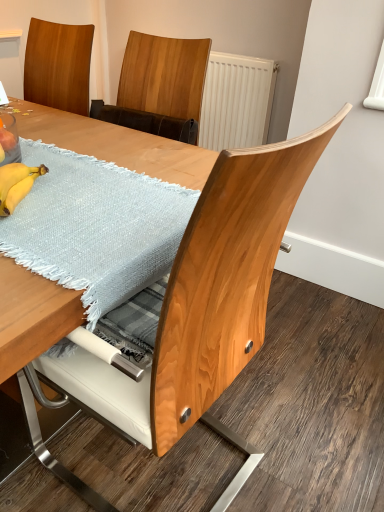
In the scene shown: In order to face light blue woven placemat at upper left, acting as the 1th table starting from the top, should I rotate leftwards or rightwards?

Rotate your view left by about 21.076°.

What do you see at coordinates (118, 144) in the screenshot? I see `wooden table at center, the 1th table in the bottom-to-top sequence` at bounding box center [118, 144].

This screenshot has height=512, width=384. Find the location of `light blue woven placemat at upper left, acting as the 1th table starting from the top`. light blue woven placemat at upper left, acting as the 1th table starting from the top is located at coordinates (115, 144).

At what (x,y) coordinates should I click in order to perform the action: click on table that is the 2nd one when counting rightward from the yellow matte bananas at lower left. Please return your answer as a coordinate pair (x, y). Image resolution: width=384 pixels, height=512 pixels. Looking at the image, I should click on (118, 144).

Is wooden table at center, the 1th table in the bottom-to-top sequence, inside or outside of yellow matte bananas at lower left?

The correct answer is: outside.

From a real-world perspective, relative to yellow matte bananas at lower left, is wooden table at center, the 1th table in the bottom-to-top sequence, vertically above or below?

wooden table at center, the 1th table in the bottom-to-top sequence, is situated lower than yellow matte bananas at lower left in the real world.

Between yellow matte bananas at lower left and wooden table at center, the second table when ordered from top to bottom, which one has smaller width?

yellow matte bananas at lower left.

From the image's perspective, between yellow matte bananas at lower left and wooden table at center, the 1th table in the bottom-to-top sequence, who is located below?

wooden table at center, the 1th table in the bottom-to-top sequence, is shown below in the image.

Is yellow matte bananas at lower left outside of wooden table at center, the second table when ordered from top to bottom?

No, yellow matte bananas at lower left is inside wooden table at center, the second table when ordered from top to bottom,'s boundary.

In the scene shown: How many degrees apart are the facing directions of yellow matte bananas at lower left and wooden table at center, the 1th table in the bottom-to-top sequence?

149 degrees.

Could you tell me if wooden table at center, the second table when ordered from top to bottom, is facing light blue woven placemat at upper left, positioned as the 2th table in bottom-to-top order?

Yes, wooden table at center, the second table when ordered from top to bottom, is aimed at light blue woven placemat at upper left, positioned as the 2th table in bottom-to-top order.

Between wooden table at center, the 1th table in the bottom-to-top sequence, and light blue woven placemat at upper left, positioned as the 2th table in bottom-to-top order, which one has larger width?

light blue woven placemat at upper left, positioned as the 2th table in bottom-to-top order.

Can you confirm if wooden table at center, the second table when ordered from top to bottom, is taller than light blue woven placemat at upper left, acting as the 1th table starting from the top?

Yes.

Which object is thinner, light blue woven placemat at upper left, positioned as the 2th table in bottom-to-top order, or yellow matte bananas at lower left?

With smaller width is yellow matte bananas at lower left.

Considering the positions of objects light blue woven placemat at upper left, positioned as the 2th table in bottom-to-top order, and yellow matte bananas at lower left in the image provided, who is in front, light blue woven placemat at upper left, positioned as the 2th table in bottom-to-top order, or yellow matte bananas at lower left?

light blue woven placemat at upper left, positioned as the 2th table in bottom-to-top order.

Which is in front, point (11, 362) or point (21, 194)?

The point (11, 362) is closer.

Is light blue woven placemat at upper left, acting as the 1th table starting from the top, looking in the opposite direction of yellow matte bananas at lower left?

Yes.

Based on the photo, is yellow matte bananas at lower left shorter than light blue woven placemat at upper left, acting as the 1th table starting from the top?

No.

In the scene shown: Is yellow matte bananas at lower left outside of light blue woven placemat at upper left, positioned as the 2th table in bottom-to-top order?

Yes, yellow matte bananas at lower left is outside of light blue woven placemat at upper left, positioned as the 2th table in bottom-to-top order.

The image size is (384, 512). Find the location of `table that is the 1st object directly below the yellow matte bananas at lower left (from a real-world perspective)`. table that is the 1st object directly below the yellow matte bananas at lower left (from a real-world perspective) is located at coordinates (115, 144).

Is point (11, 198) positioned in front of point (47, 125)?

Yes, point (11, 198) is in front of point (47, 125).

Where is `table below the light blue woven placemat at upper left, positioned as the 2th table in bottom-to-top order (from the image's perspective)`? The height and width of the screenshot is (512, 384). table below the light blue woven placemat at upper left, positioned as the 2th table in bottom-to-top order (from the image's perspective) is located at coordinates (118, 144).

From a real-world perspective, is light blue woven placemat at upper left, positioned as the 2th table in bottom-to-top order, physically above wooden table at center, the second table when ordered from top to bottom?

Yes, from a real-world perspective, light blue woven placemat at upper left, positioned as the 2th table in bottom-to-top order, is on top of wooden table at center, the second table when ordered from top to bottom.

Are light blue woven placemat at upper left, acting as the 1th table starting from the top, and wooden table at center, the 1th table in the bottom-to-top sequence, located far from each other?

No, there isn't a large distance between light blue woven placemat at upper left, acting as the 1th table starting from the top, and wooden table at center, the 1th table in the bottom-to-top sequence.

Considering the sizes of objects light blue woven placemat at upper left, positioned as the 2th table in bottom-to-top order, and wooden table at center, the second table when ordered from top to bottom, in the image provided, who is taller, light blue woven placemat at upper left, positioned as the 2th table in bottom-to-top order, or wooden table at center, the second table when ordered from top to bottom,?

With more height is wooden table at center, the second table when ordered from top to bottom.

Where is `table below the yellow matte bananas at lower left (from the image's perspective)`? The image size is (384, 512). table below the yellow matte bananas at lower left (from the image's perspective) is located at coordinates point(118,144).

The width and height of the screenshot is (384, 512). Find the location of `banana that is on the left side of wooden table at center, the 1th table in the bottom-to-top sequence`. banana that is on the left side of wooden table at center, the 1th table in the bottom-to-top sequence is located at coordinates (16, 184).

Which object lies further to the anchor point light blue woven placemat at upper left, positioned as the 2th table in bottom-to-top order, wooden table at center, the second table when ordered from top to bottom, or yellow matte bananas at lower left?

Based on the image, wooden table at center, the second table when ordered from top to bottom, appears to be further to light blue woven placemat at upper left, positioned as the 2th table in bottom-to-top order.

Considering their positions, is yellow matte bananas at lower left positioned closer to light blue woven placemat at upper left, positioned as the 2th table in bottom-to-top order, than wooden table at center, the 1th table in the bottom-to-top sequence?

The object closer to light blue woven placemat at upper left, positioned as the 2th table in bottom-to-top order, is yellow matte bananas at lower left.

From the image, which object appears to be farther from yellow matte bananas at lower left, light blue woven placemat at upper left, positioned as the 2th table in bottom-to-top order, or wooden table at center, the 1th table in the bottom-to-top sequence?

wooden table at center, the 1th table in the bottom-to-top sequence, is further to yellow matte bananas at lower left.

Estimate the real-world distances between objects in this image. Which object is closer to wooden table at center, the 1th table in the bottom-to-top sequence, yellow matte bananas at lower left or light blue woven placemat at upper left, positioned as the 2th table in bottom-to-top order?

yellow matte bananas at lower left is positioned closer to the anchor wooden table at center, the 1th table in the bottom-to-top sequence.

Consider the image. Estimate the real-world distances between objects in this image. Which object is closer to yellow matte bananas at lower left, wooden table at center, the second table when ordered from top to bottom, or light blue woven placemat at upper left, acting as the 1th table starting from the top?

light blue woven placemat at upper left, acting as the 1th table starting from the top, is positioned closer to the anchor yellow matte bananas at lower left.

When comparing their distances from wooden table at center, the second table when ordered from top to bottom, does light blue woven placemat at upper left, positioned as the 2th table in bottom-to-top order, or yellow matte bananas at lower left seem closer?

Based on the image, yellow matte bananas at lower left appears to be nearer to wooden table at center, the second table when ordered from top to bottom.

Where is `table positioned between wooden table at center, the 1th table in the bottom-to-top sequence, and yellow matte bananas at lower left from near to far`? This screenshot has height=512, width=384. table positioned between wooden table at center, the 1th table in the bottom-to-top sequence, and yellow matte bananas at lower left from near to far is located at coordinates 115,144.